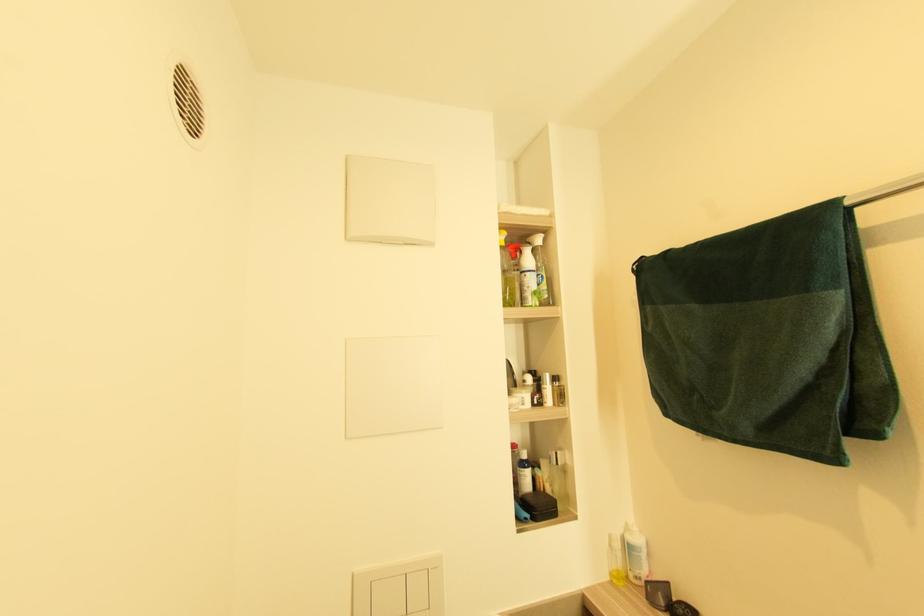
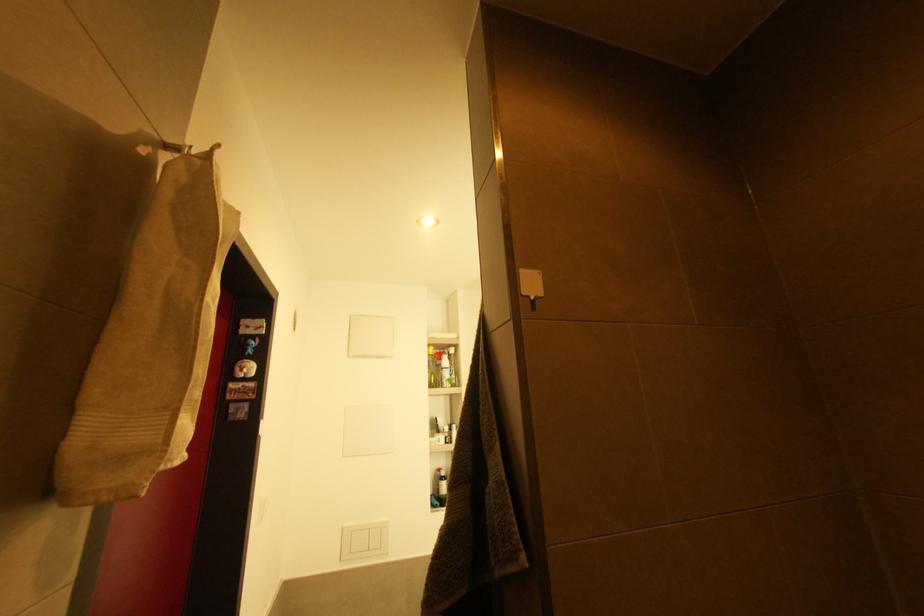
Question: In a continuous first-person perspective shot, in which direction is the camera moving?

Choices:
 (A) Left
 (B) Right
 (C) Forward
 (D) Backward

Answer: (D)